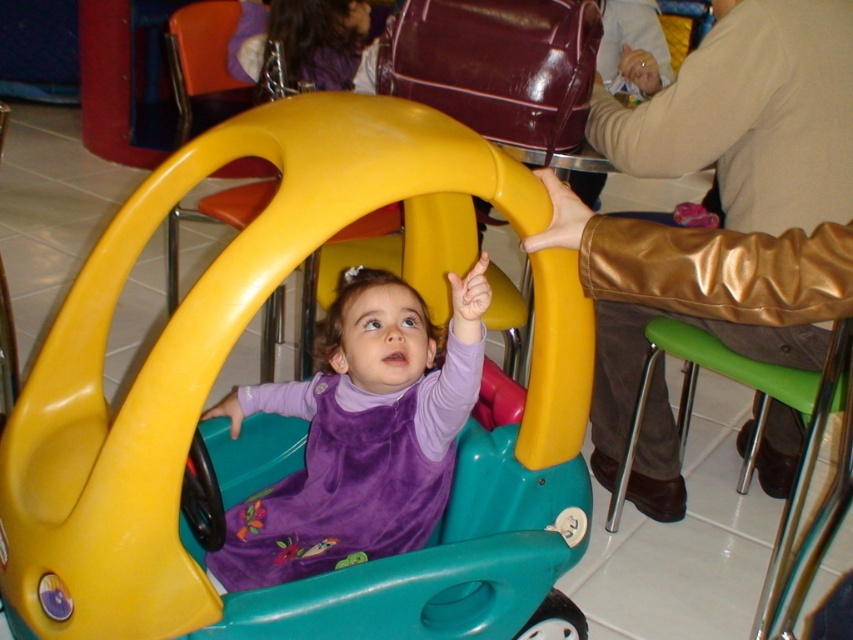
Measure the distance between matte plastic toy car at center and camera.

They are 34.82 inches apart.

Who is lower down, matte plastic toy car at center or purple velvet toddler at center?

Positioned lower is matte plastic toy car at center.

Which is in front, point (439, 136) or point (431, 340)?

Point (439, 136) is more forward.

What are the coordinates of `matte plastic toy car at center` in the screenshot? It's located at (213, 381).